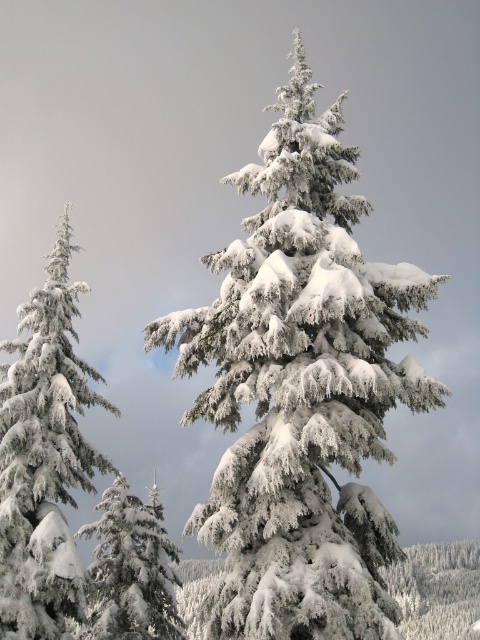
Question: Which of the following is the farthest from the observer?

Choices:
 (A) (60, 497)
 (B) (108, 522)
 (C) (322, 212)

Answer: (B)

Question: Which point is farther to the camera?

Choices:
 (A) (1, 502)
 (B) (251, 332)
 (C) (177, 611)

Answer: (C)

Question: Is snow-covered evergreen at center to the right of white frosty pine at lower left from the viewer's perspective?

Choices:
 (A) yes
 (B) no

Answer: (A)

Question: Can you confirm if white frosty pine at left is thinner than white frosty pine at lower left?

Choices:
 (A) yes
 (B) no

Answer: (A)

Question: Which of the following is the closest to the observer?

Choices:
 (A) white frosty pine at lower left
 (B) snow-covered evergreen at center

Answer: (B)

Question: Can you confirm if white frosty pine at left is thinner than white frosty pine at lower left?

Choices:
 (A) yes
 (B) no

Answer: (A)